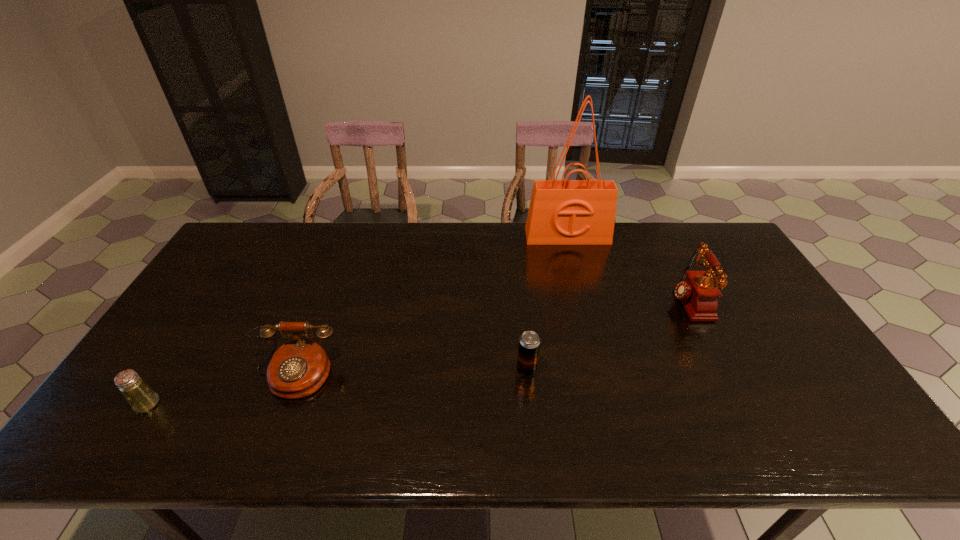
Locate which object is the second closest to the beer can. Please provide its 2D coordinates. Your answer should be formatted as a tuple, i.e. [(x, y)], where the tuple contains the x and y coordinates of a point satisfying the conditions above.

[(297, 369)]

This screenshot has height=540, width=960. I want to click on the fourth closest object to the left telephone, so click(x=698, y=293).

Find the location of a particular element. This screenshot has width=960, height=540. free space that satisfies the following two spatial constraints: 1. on the dial of the rightmost object; 2. on the dial of the second object from left to right is located at coordinates (725, 374).